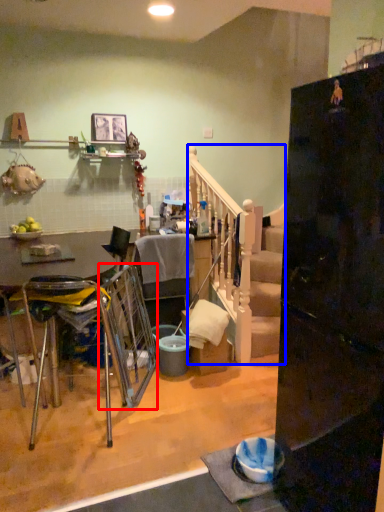
Question: Among these objects, which one is farthest to the camera, swivel chair (highlighted by a red box) or rail (highlighted by a blue box)?

Choices:
 (A) swivel chair
 (B) rail

Answer: (B)